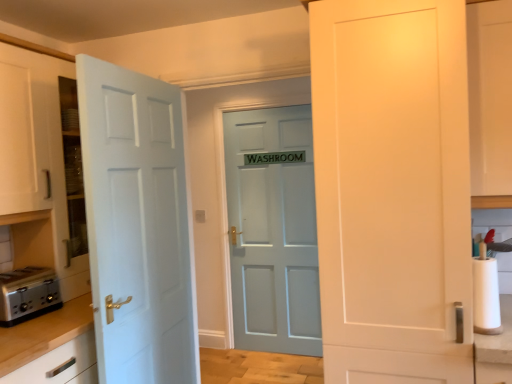
Question: Visually, is matte blue door at center, marked as the third door in a front-to-back arrangement, positioned to the left or to the right of light blue painted door at left, the second door positioned from the front?

Choices:
 (A) left
 (B) right

Answer: (B)

Question: Does point (274, 137) appear closer or farther from the camera than point (142, 284)?

Choices:
 (A) farther
 (B) closer

Answer: (A)

Question: Estimate the real-world distances between objects in this image. Which object is farther from the white glossy cabinet at left?

Choices:
 (A) silver metallic toaster at lower left
 (B) white glossy cabinet at upper right
 (C) matte blue door at center, marked as the first door in a back-to-front arrangement
 (D) white paper at right
 (E) white matte door at right, the 1th door when ordered from front to back

Answer: (B)

Question: Which object is the closest to the silver metallic toaster at lower left?

Choices:
 (A) white matte door at right, acting as the 3th door starting from the back
 (B) white glossy cabinet at left
 (C) white glossy cabinet at upper right
 (D) light blue painted door at left, the second door positioned from the front
 (E) matte blue door at center, marked as the first door in a back-to-front arrangement

Answer: (B)